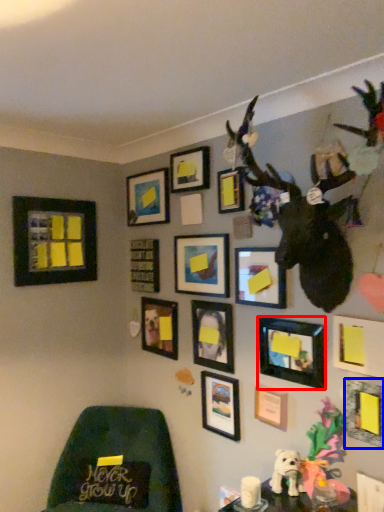
Question: Among these objects, which one is nearest to the camera, picture frame (highlighted by a red box) or picture frame (highlighted by a blue box)?

Choices:
 (A) picture frame
 (B) picture frame

Answer: (B)